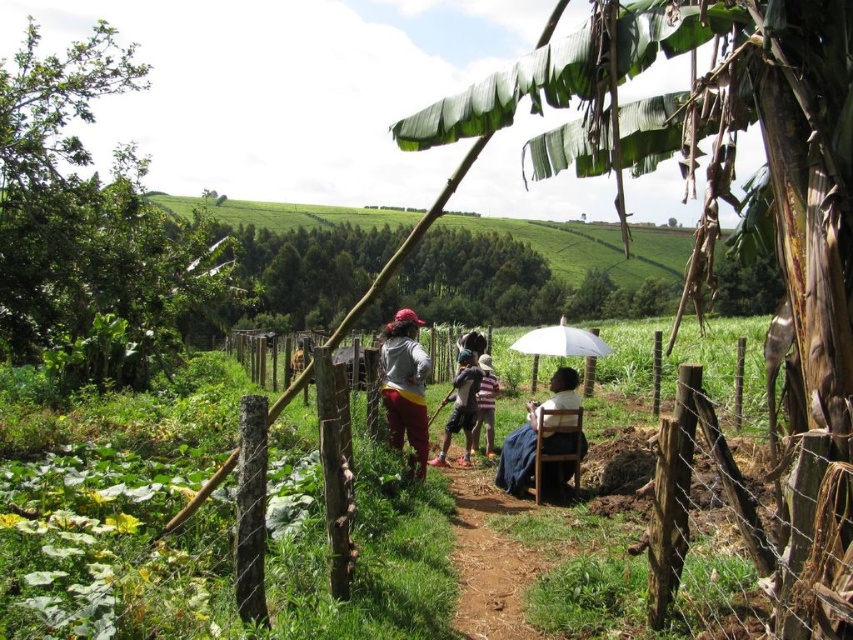
You are standing at the dirt path in the rural scene and want to determine which of the two points, point [675,45] or point [465,419], is closer to you. Based on the scene description, which point is nearer?

Point [675,45] is closer to the viewer than point [465,419].

You are a farmer walking along the dirt path in the foreground. You want to reach the brown wooden fence at center to check on your crops. However, there is a green leafy banana tree at upper right blocking your way. Can you walk around the tree to reach the fence?

The green leafy banana tree at upper right is positioned on the left side of brown wooden fence at center, so you can walk around the tree to the right side of the fence to reach it.